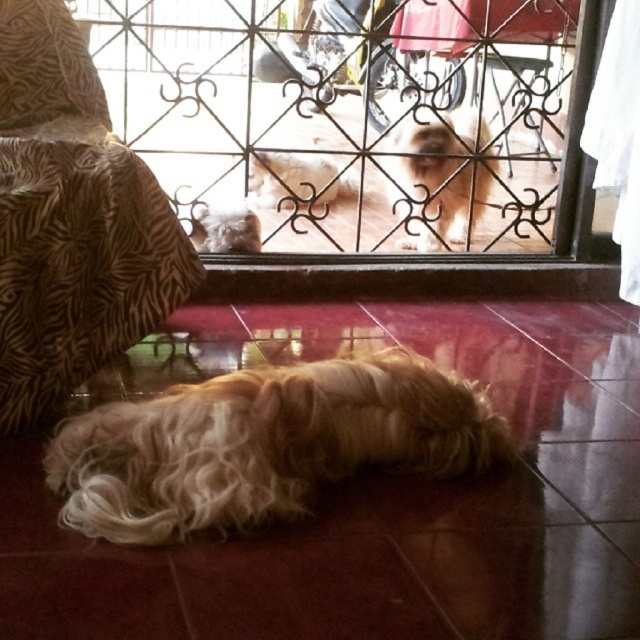
Question: Among these objects, which one is farthest from the camera?

Choices:
 (A) fuzzy beige dog at center
 (B) white fluffy dog at center
 (C) fluffy golden dog at lower center

Answer: (A)

Question: Which object is positioned farthest from the clear glass door at center?

Choices:
 (A) white fluffy dog at upper center
 (B) fuzzy beige dog at center
 (C) fluffy golden dog at lower center
 (D) fuzzy fur dog at lower center

Answer: (C)

Question: Does white fluffy dog at center come behind white fluffy dog at upper center?

Choices:
 (A) yes
 (B) no

Answer: (A)

Question: Does fuzzy beige dog at center have a smaller size compared to white fluffy dog at center?

Choices:
 (A) no
 (B) yes

Answer: (A)

Question: Which object is positioned closest to the white fluffy dog at center?

Choices:
 (A) fluffy golden dog at lower center
 (B) fuzzy fur dog at lower center

Answer: (B)

Question: Is clear glass door at center positioned at the back of fuzzy beige dog at center?

Choices:
 (A) no
 (B) yes

Answer: (A)